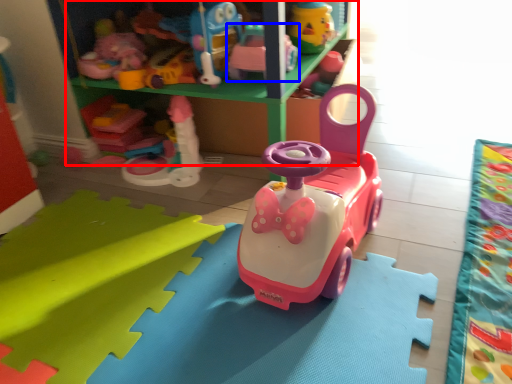
Question: Which of the following is the closest to the observer, shelf (highlighted by a red box) or toy (highlighted by a blue box)?

Choices:
 (A) shelf
 (B) toy

Answer: (A)